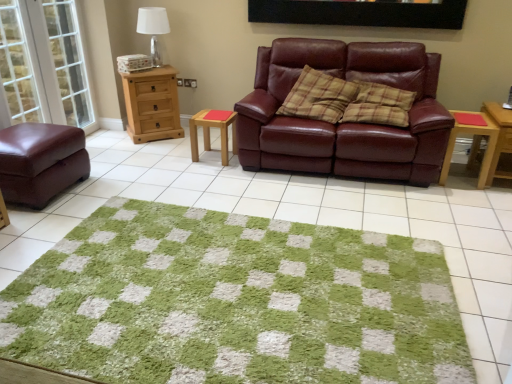
Identify the location of vacant space to the left of wooden stool at center, which is the 3th table in right-to-left order. The image size is (512, 384). (178, 153).